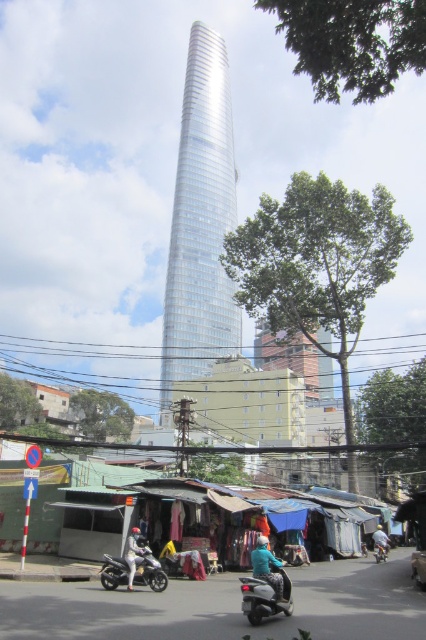
You are a delivery person who needs to choose between the metallic silver scooter at center and the silver metallic motorcycle at lower left for a delivery job that requires carrying heavy packages. Which vehicle would be more suitable based on their sizes?

The silver metallic motorcycle at lower left is larger than the metallic silver scooter at center, so it would be more suitable for carrying heavy packages.

You are a pedestrian standing at the edge of the street. You see a metallic silver scooter at center and a silver metallic motorcycle at lower left. Which vehicle is closer to you?

The metallic silver scooter at center is closer to you since it is positioned in front of the silver metallic motorcycle at lower left.